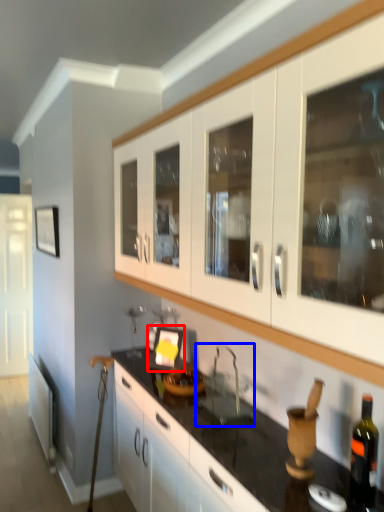
Question: Which object is further to the camera taking this photo, picture frame (highlighted by a red box) or sink (highlighted by a blue box)?

Choices:
 (A) picture frame
 (B) sink

Answer: (A)